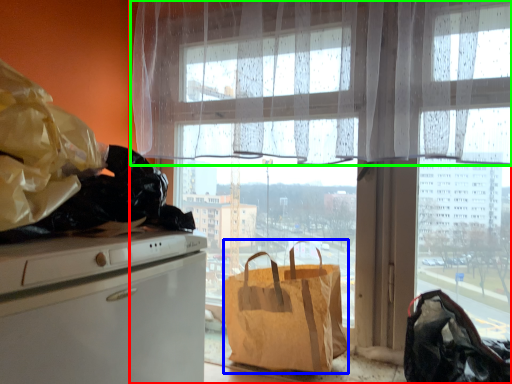
Question: Which is farther away from window (highlighted by a red box)? handbag (highlighted by a blue box) or curtain (highlighted by a green box)?

Choices:
 (A) handbag
 (B) curtain

Answer: (A)